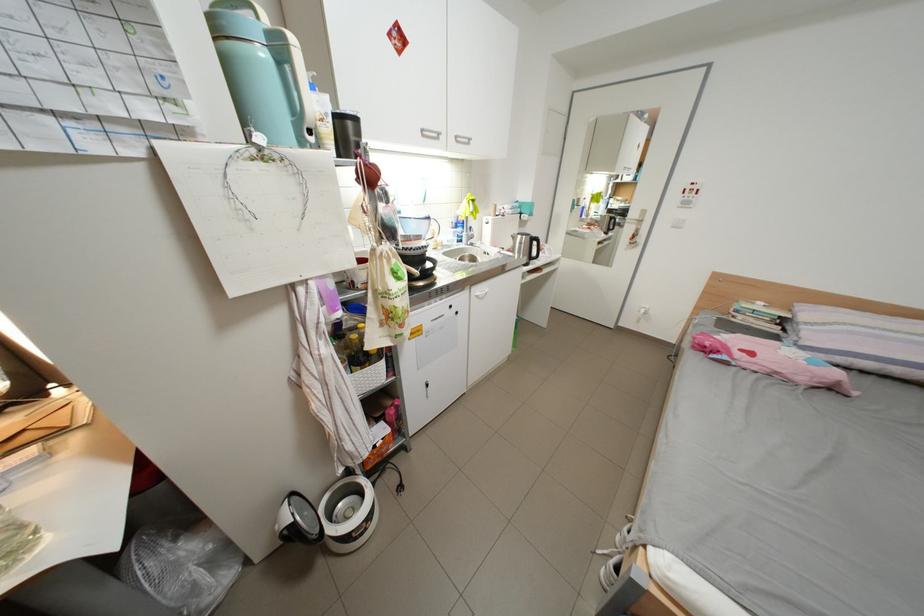
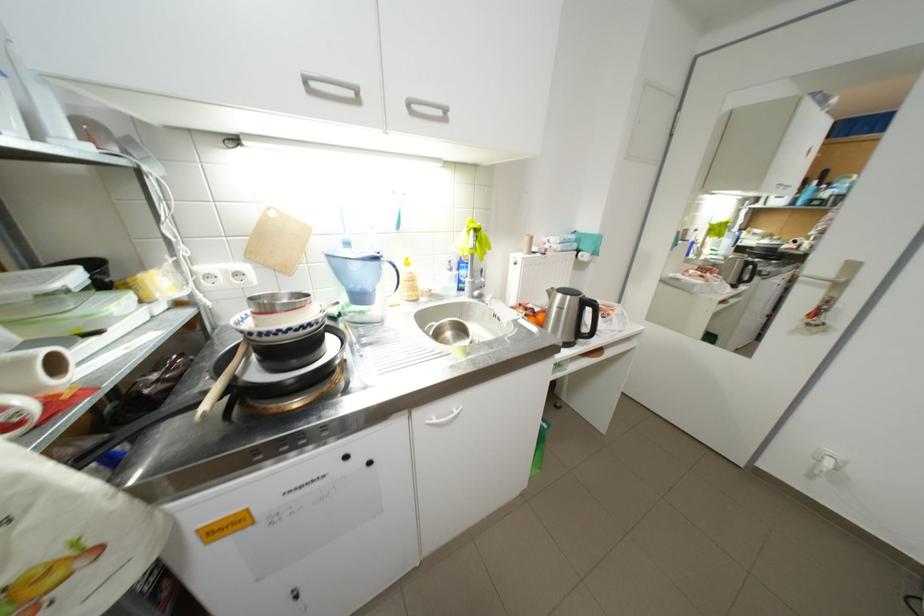
In the second image, find the point that corresponds to (468,139) in the first image.

(420, 105)